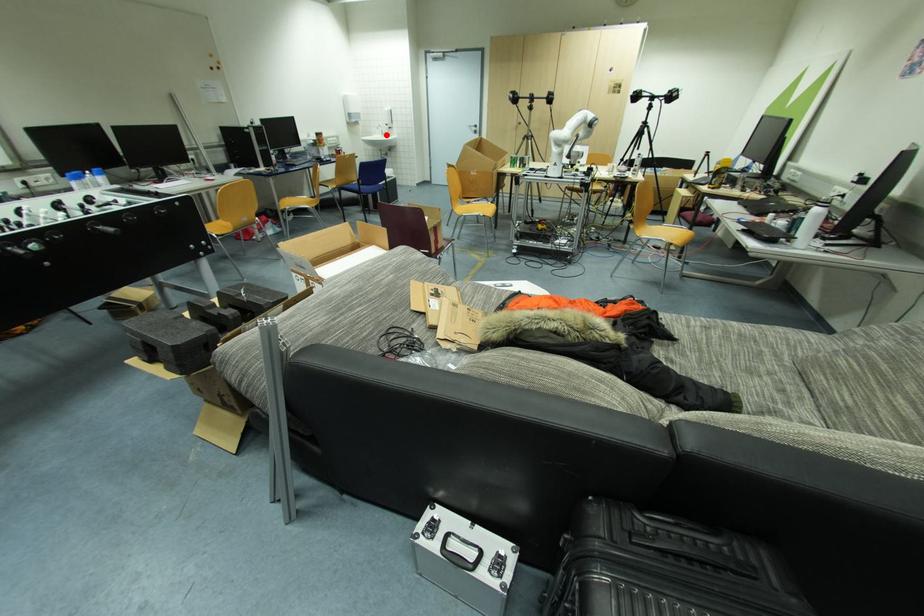
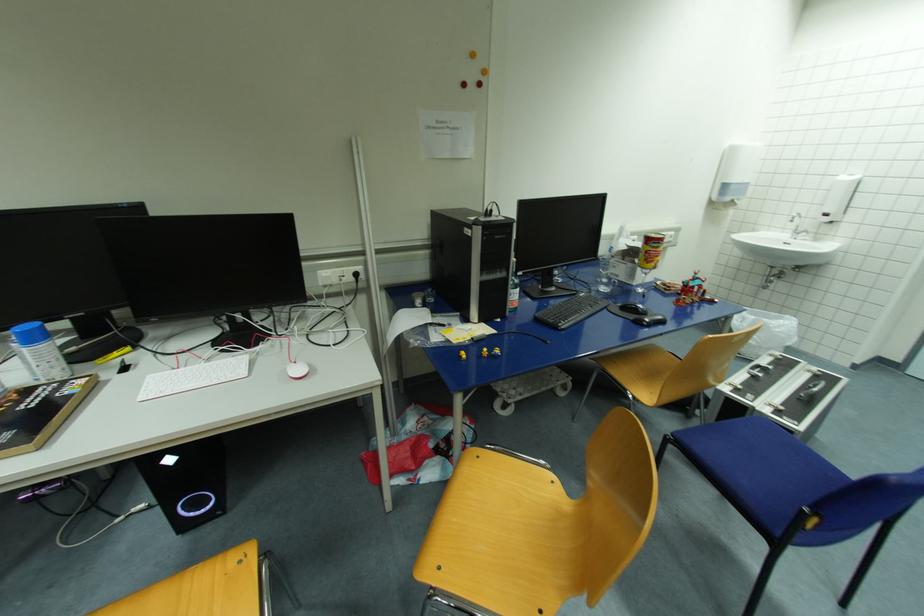
Question: I am providing you with two images of the same scene from different viewpoints. In image1, a red point is highlighted. Considering the same 3D point in image2, which of the following is correct?

Choices:
 (A) It is closer
 (B) It is farther

Answer: (B)